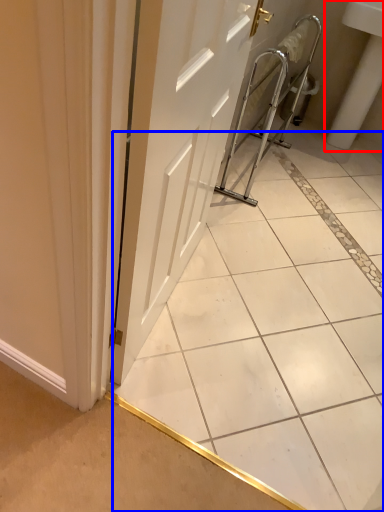
Question: Which object appears farthest to the camera in this image, sink (highlighted by a red box) or ceramic tile (highlighted by a blue box)?

Choices:
 (A) sink
 (B) ceramic tile

Answer: (A)